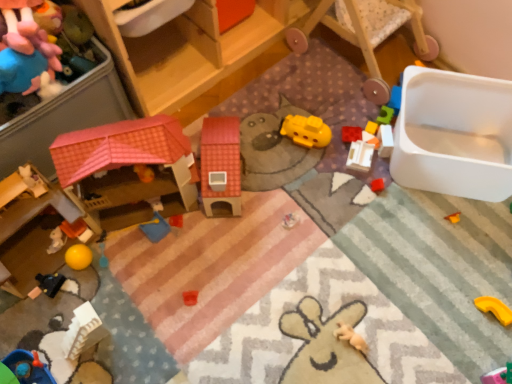
This screenshot has width=512, height=384. I want to click on free area in between yellow matte submarine at center, which is the 5th toy in left-to-right order, and light brown plush toy at lower right, the sixth toy from the right, so click(324, 226).